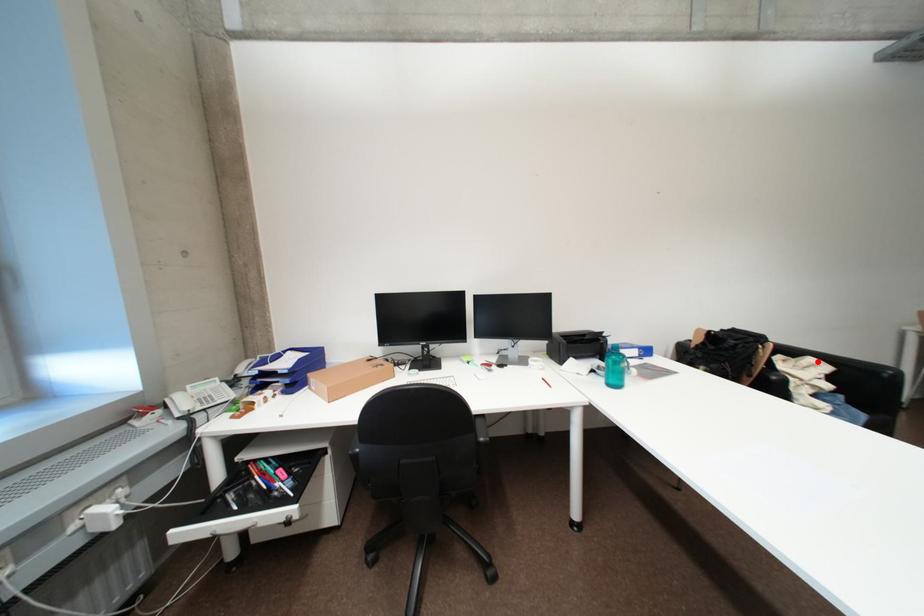
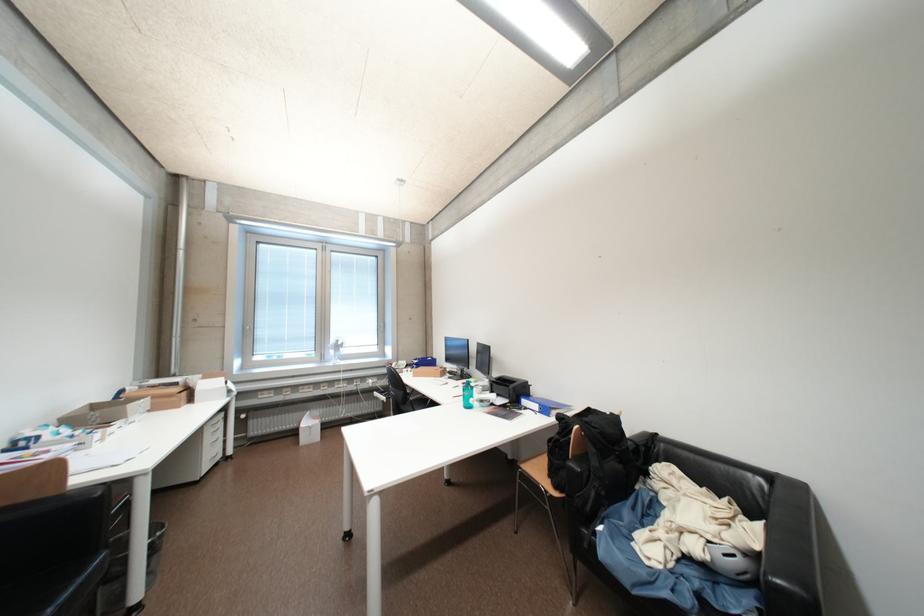
Question: I am providing you with two images of the same scene from different viewpoints. In image1, a red point is highlighted. Considering the same 3D point in image2, which of the following is correct?

Choices:
 (A) It is closer
 (B) It is farther

Answer: (A)